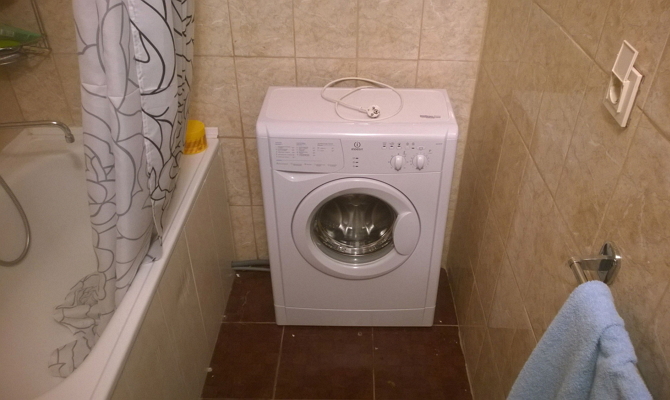
The height and width of the screenshot is (400, 670). Find the location of `washing machine`. washing machine is located at coordinates pos(362,225).